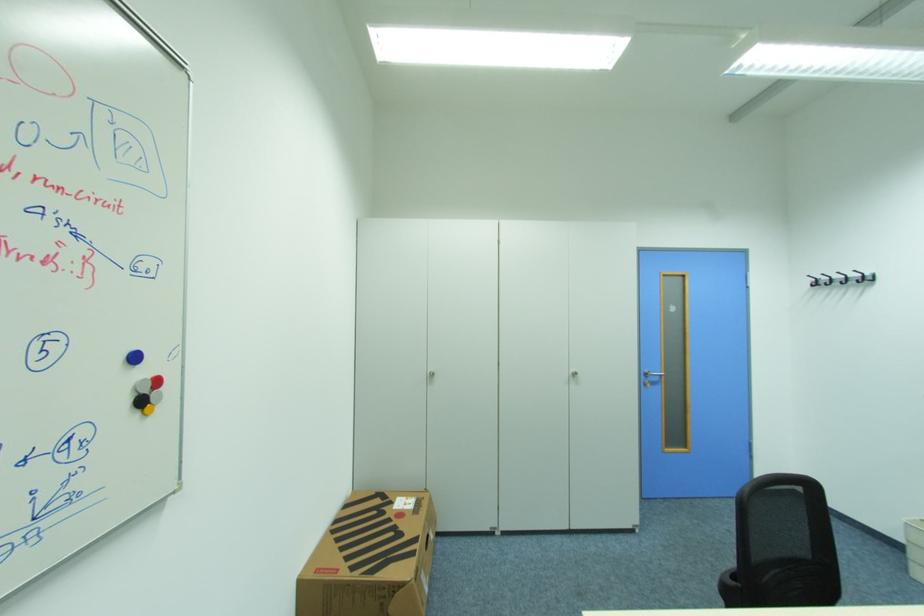
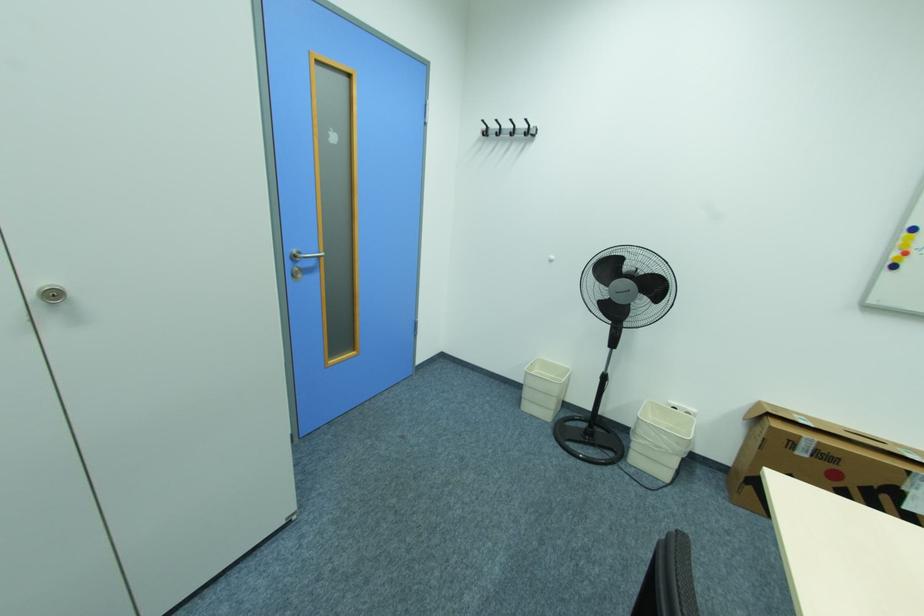
Where in the second image is the point corresponding to (x=651, y=371) from the first image?

(300, 252)